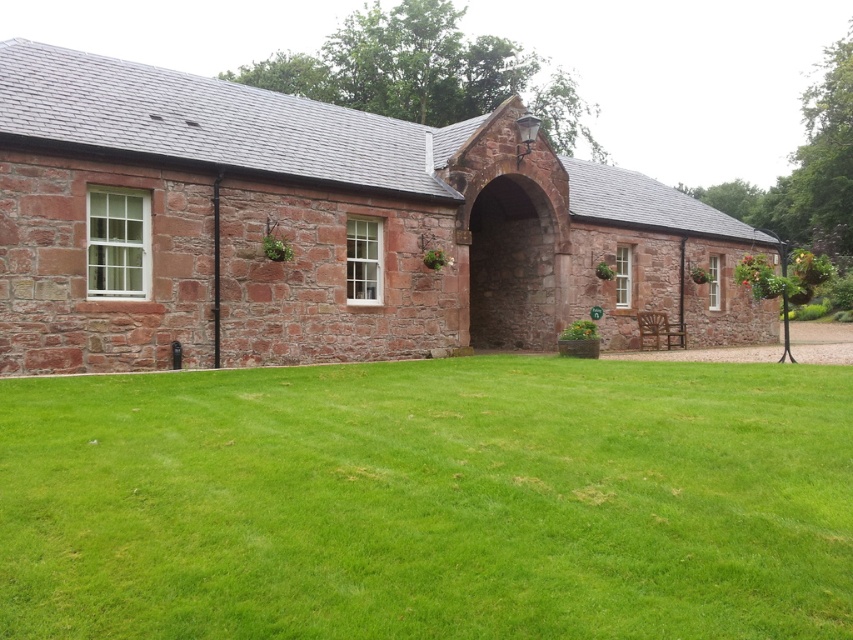
Question: Is the position of green grass at center more distant than that of rustic stone archway at center?

Choices:
 (A) no
 (B) yes

Answer: (A)

Question: Which object is closer to the camera taking this photo?

Choices:
 (A) green grass at center
 (B) rustic stone archway at center

Answer: (A)

Question: Can you confirm if green grass at center is wider than rustic stone archway at center?

Choices:
 (A) yes
 (B) no

Answer: (A)

Question: Which of these objects is positioned farthest from the rustic stone chapel at center?

Choices:
 (A) green grass at center
 (B) rustic stone archway at center

Answer: (A)

Question: Is rustic stone chapel at center below rustic stone archway at center?

Choices:
 (A) yes
 (B) no

Answer: (B)

Question: Which object is closer to the camera taking this photo?

Choices:
 (A) rustic stone archway at center
 (B) green grass at center

Answer: (B)